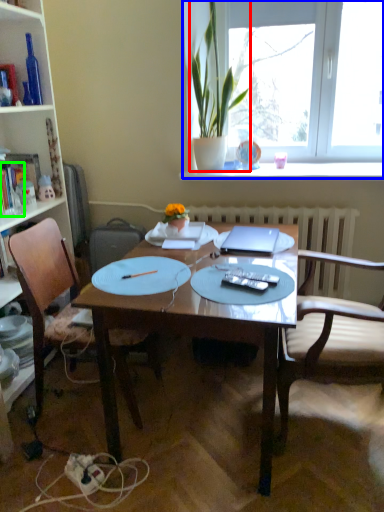
Question: Which object is the farthest from houseplant (highlighted by a red box)? Choose among these: window (highlighted by a blue box) or book (highlighted by a green box).

Choices:
 (A) window
 (B) book

Answer: (B)